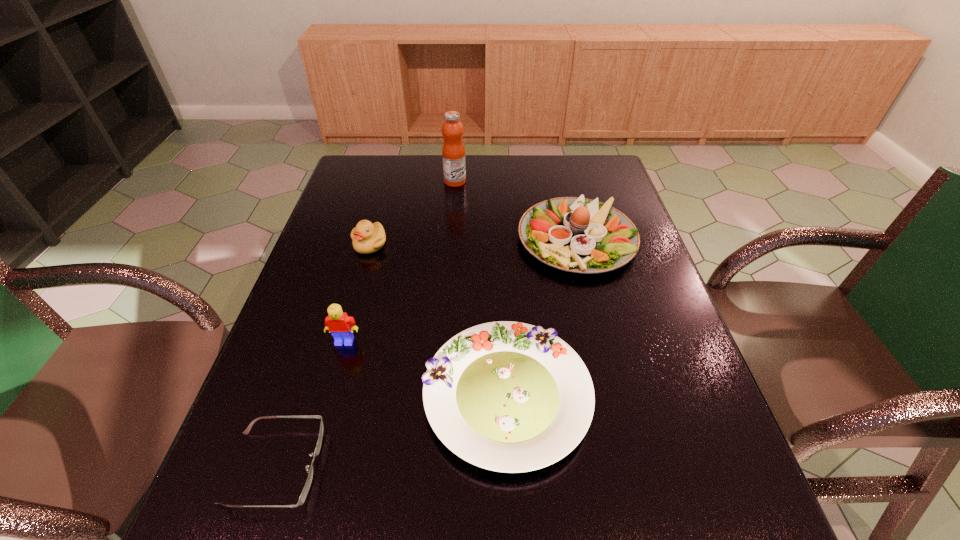
In order to click on free location that satisfies the following two spatial constraints: 1. on the back side of the fifth tallest object; 2. on the front label of the farthest object in this screenshot , I will do `click(496, 181)`.

Find the location of a particular element. Image resolution: width=960 pixels, height=540 pixels. vacant space that satisfies the following two spatial constraints: 1. on the front label of the fruit juice; 2. on the front-facing side of the Lego is located at coordinates (443, 341).

I want to click on free space in the image that satisfies the following two spatial constraints: 1. on the beak of the duckling; 2. on the front-facing side of the shortest object, so click(x=308, y=467).

The width and height of the screenshot is (960, 540). What are the coordinates of `vacant space that satisfies the following two spatial constraints: 1. on the beak of the fourth tallest object; 2. on the front-facing side of the shortest object` in the screenshot? It's located at (308, 467).

In order to click on free spot that satisfies the following two spatial constraints: 1. on the front label of the fruit juice; 2. on the front-facing side of the Lego in this screenshot , I will do `click(443, 341)`.